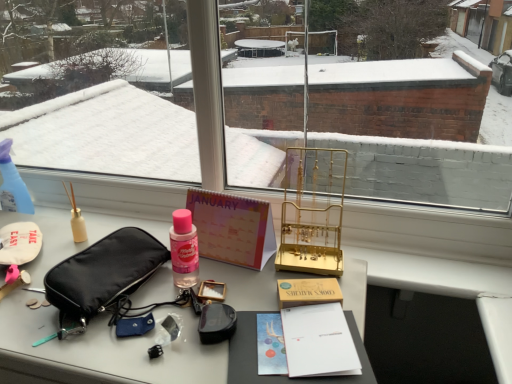
Question: From the image's perspective, would you say transparent plastic spray bottle at left is positioned over pastel paper calendar at center?

Choices:
 (A) no
 (B) yes

Answer: (B)

Question: From the image's perspective, is transparent plastic spray bottle at left located beneath pastel paper calendar at center?

Choices:
 (A) yes
 (B) no

Answer: (B)

Question: Is transparent plastic spray bottle at left aimed at pastel paper calendar at center?

Choices:
 (A) yes
 (B) no

Answer: (B)

Question: Considering the relative positions of transparent plastic spray bottle at left and pastel paper calendar at center in the image provided, is transparent plastic spray bottle at left in front of pastel paper calendar at center?

Choices:
 (A) yes
 (B) no

Answer: (B)

Question: From a real-world perspective, is transparent plastic spray bottle at left below pastel paper calendar at center?

Choices:
 (A) no
 (B) yes

Answer: (A)

Question: Does transparent plastic spray bottle at left have a lesser width compared to pastel paper calendar at center?

Choices:
 (A) yes
 (B) no

Answer: (B)

Question: Considering the relative sizes of pastel paper calendar at center and transparent plastic spray bottle at left in the image provided, is pastel paper calendar at center shorter than transparent plastic spray bottle at left?

Choices:
 (A) no
 (B) yes

Answer: (A)

Question: Would you say pastel paper calendar at center contains transparent plastic spray bottle at left?

Choices:
 (A) yes
 (B) no

Answer: (B)

Question: Does pastel paper calendar at center lie behind transparent plastic spray bottle at left?

Choices:
 (A) yes
 (B) no

Answer: (B)

Question: From the image's perspective, is pastel paper calendar at center located beneath transparent plastic spray bottle at left?

Choices:
 (A) no
 (B) yes

Answer: (B)

Question: Is pastel paper calendar at center to the left of transparent plastic spray bottle at left from the viewer's perspective?

Choices:
 (A) no
 (B) yes

Answer: (A)

Question: Is pastel paper calendar at center bigger than transparent plastic spray bottle at left?

Choices:
 (A) no
 (B) yes

Answer: (B)

Question: Is the surface of matte black pouch at left in direct contact with pastel paper calendar at center?

Choices:
 (A) yes
 (B) no

Answer: (B)